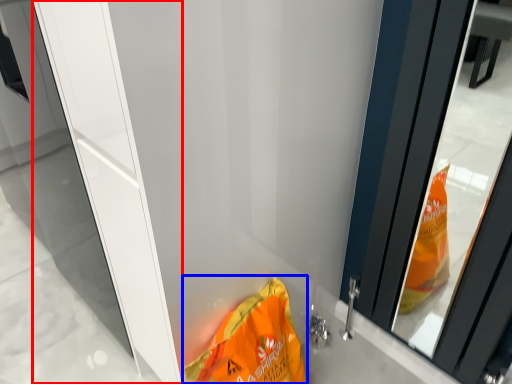
Question: Which point is closer to the camera, screen door (highlighted by a red box) or waste (highlighted by a blue box)?

Choices:
 (A) screen door
 (B) waste

Answer: (A)